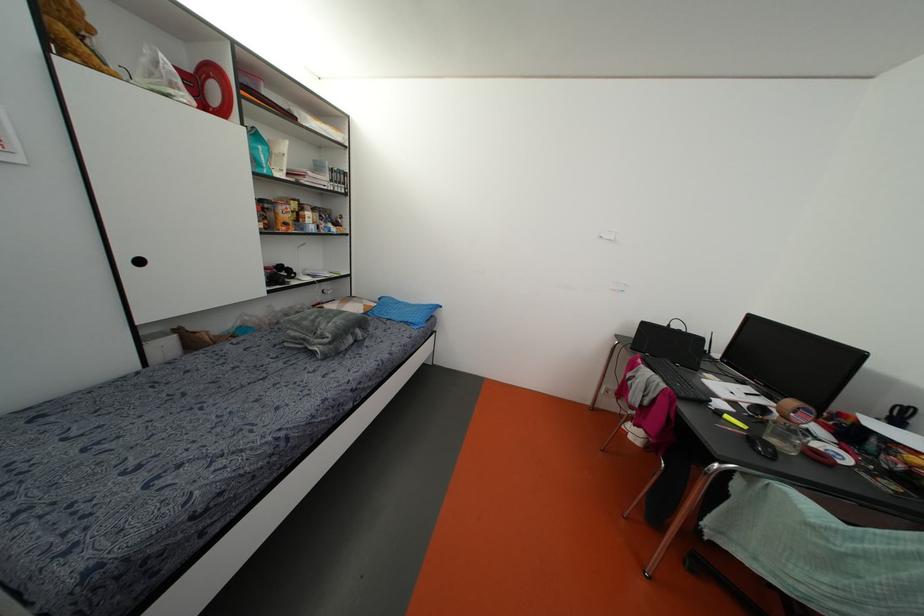
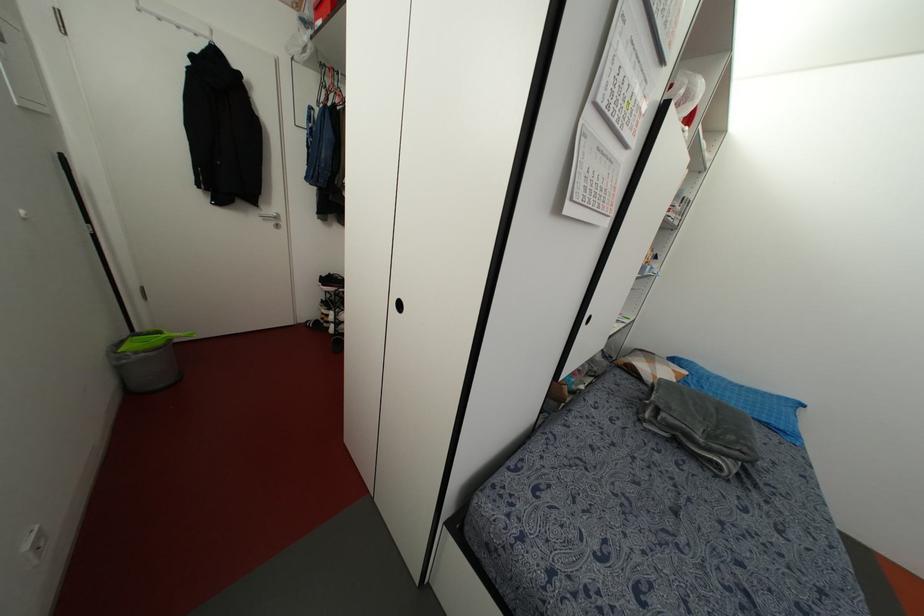
The point at (411, 321) is marked in the first image. Where is the corresponding point in the second image?

(782, 427)